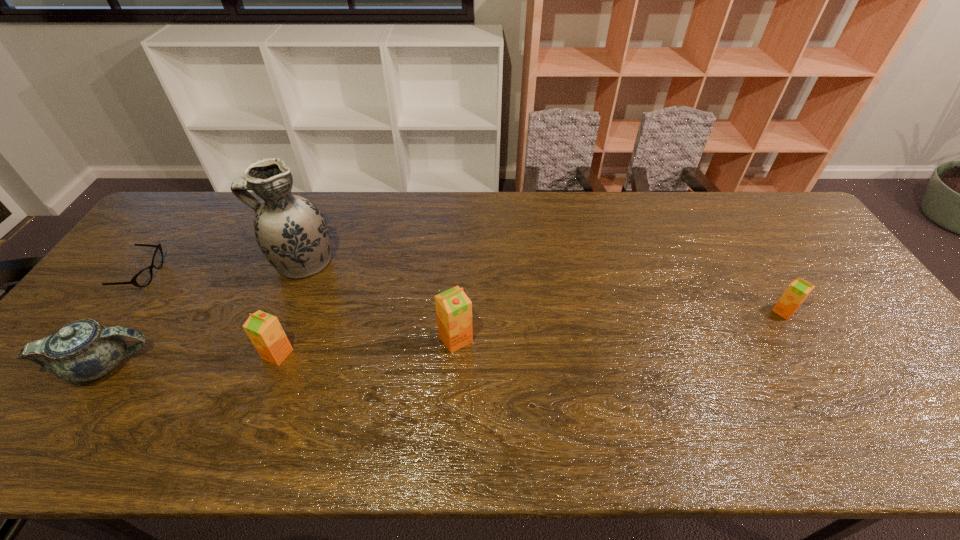
Please point a space for a new orange_juice to maintain equal intervals. Please provide its 2D coordinates. Your answer should be formatted as a tuple, i.e. [(x, y)], where the tuple contains the x and y coordinates of a point satisfying the conditions above.

[(624, 325)]